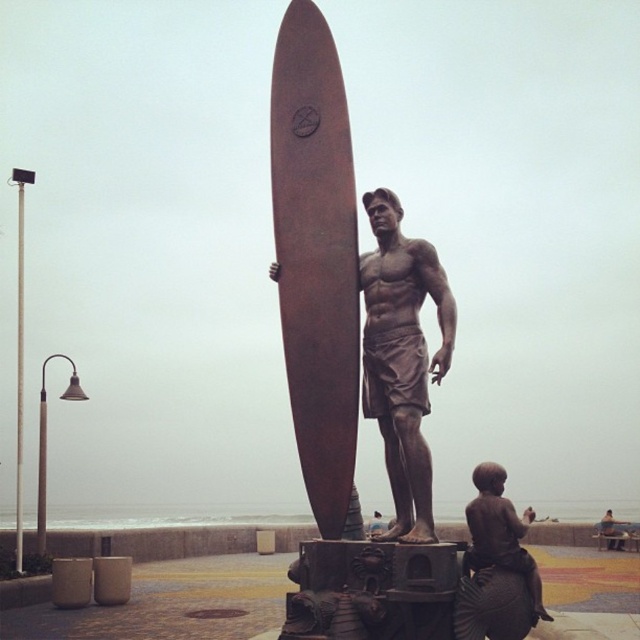
Does point (449, 305) come closer to viewer compared to point (513, 563)?

No, (449, 305) is behind (513, 563).

What do you see at coordinates (403, 356) in the screenshot?
I see `bronze statue at center` at bounding box center [403, 356].

Who is more distant from viewer, (376, 218) or (531, 580)?

Point (376, 218)

This screenshot has height=640, width=640. Find the location of `bronze statue at center`. bronze statue at center is located at coordinates (403, 356).

Is rusty brown surfboard at center above brown matte statue at lower right?

Yes.

Which of these two, rusty brown surfboard at center or brown matte statue at lower right, stands shorter?

With less height is brown matte statue at lower right.

Image resolution: width=640 pixels, height=640 pixels. I want to click on rusty brown surfboard at center, so [316, 260].

Which is behind, point (328, 204) or point (417, 531)?

The point (328, 204) is behind.

Is point (332, 424) positioned before point (372, 403)?

Yes, point (332, 424) is closer to viewer.

Locate an element on the screen. This screenshot has width=640, height=640. rusty brown surfboard at center is located at coordinates click(316, 260).